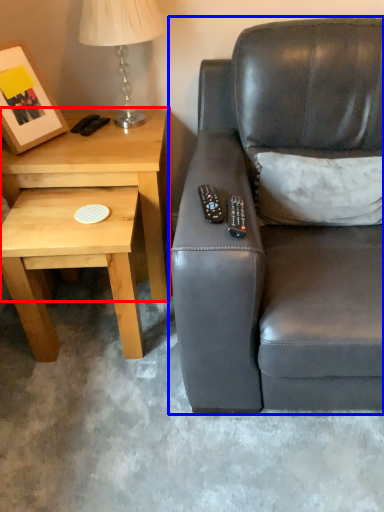
Question: Which of the following is the closest to the observer, table (highlighted by a red box) or studio couch (highlighted by a blue box)?

Choices:
 (A) table
 (B) studio couch

Answer: (B)